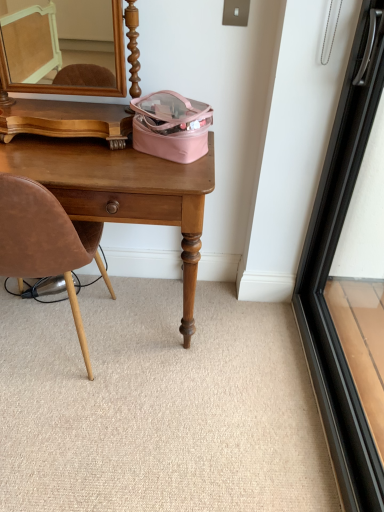
Question: From a real-world perspective, is brown leather chair at left positioned over wooden desk at center based on gravity?

Choices:
 (A) no
 (B) yes

Answer: (B)

Question: Is brown leather chair at left taller than wooden desk at center?

Choices:
 (A) no
 (B) yes

Answer: (B)

Question: Is brown leather chair at left aimed at wooden desk at center?

Choices:
 (A) no
 (B) yes

Answer: (B)

Question: Is brown leather chair at left wider than wooden desk at center?

Choices:
 (A) no
 (B) yes

Answer: (B)

Question: Would you consider brown leather chair at left to be distant from wooden desk at center?

Choices:
 (A) no
 (B) yes

Answer: (A)

Question: Is brown leather chair at left touching wooden desk at center?

Choices:
 (A) yes
 (B) no

Answer: (B)

Question: Would you say black glass screen door at right is a long distance from brown leather chair at left?

Choices:
 (A) no
 (B) yes

Answer: (A)

Question: Can you confirm if black glass screen door at right is wider than brown leather chair at left?

Choices:
 (A) yes
 (B) no

Answer: (B)

Question: Considering the relative sizes of black glass screen door at right and brown leather chair at left in the image provided, is black glass screen door at right shorter than brown leather chair at left?

Choices:
 (A) yes
 (B) no

Answer: (B)

Question: From the image's perspective, is black glass screen door at right on top of brown leather chair at left?

Choices:
 (A) yes
 (B) no

Answer: (B)

Question: From the image's perspective, does black glass screen door at right appear lower than brown leather chair at left?

Choices:
 (A) no
 (B) yes

Answer: (B)

Question: From a real-world perspective, is black glass screen door at right physically above brown leather chair at left?

Choices:
 (A) no
 (B) yes

Answer: (B)

Question: Would you consider beige carpet at lower center to be distant from black glass screen door at right?

Choices:
 (A) yes
 (B) no

Answer: (B)